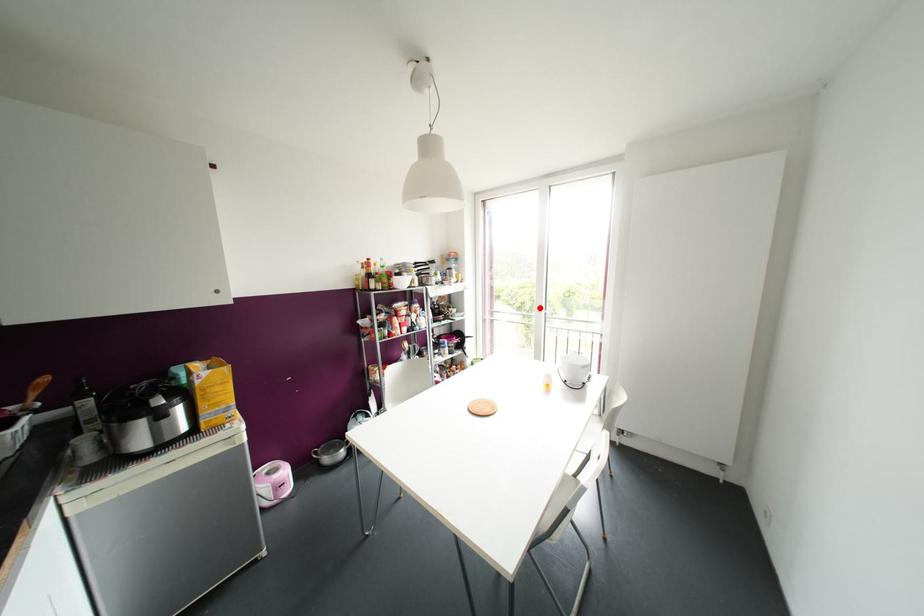
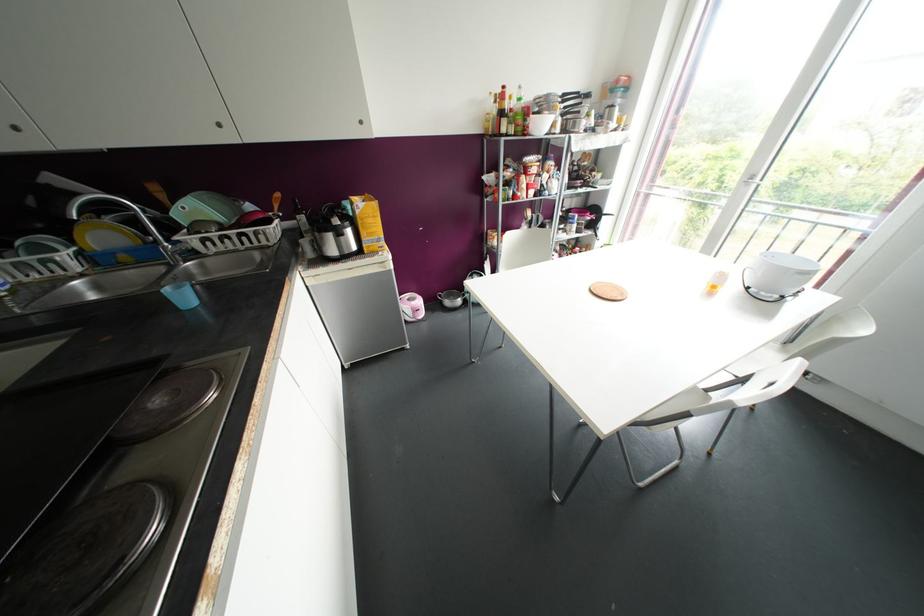
Where in the second image is the point corresponding to the highlighted location from the first image?

(752, 177)